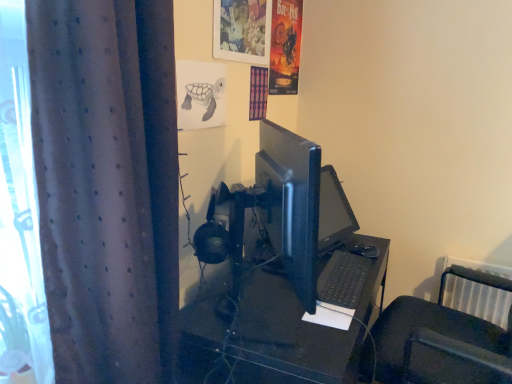
This screenshot has width=512, height=384. Find the location of `vacant point above black plastic keyboard at lower center (from a real-world perspective)`. vacant point above black plastic keyboard at lower center (from a real-world perspective) is located at coordinates (334, 272).